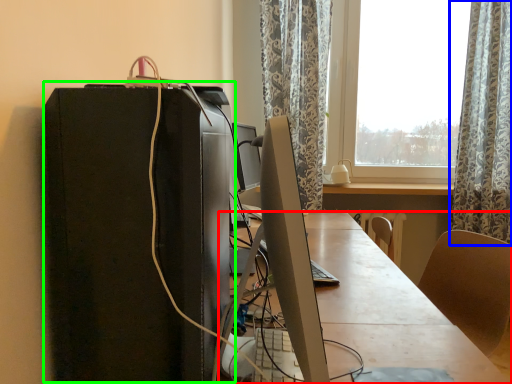
Question: Which object is positioned farthest from desk (highlighted by a red box)? Select from curtain (highlighted by a blue box) and computer tower (highlighted by a green box).

Choices:
 (A) curtain
 (B) computer tower

Answer: (A)